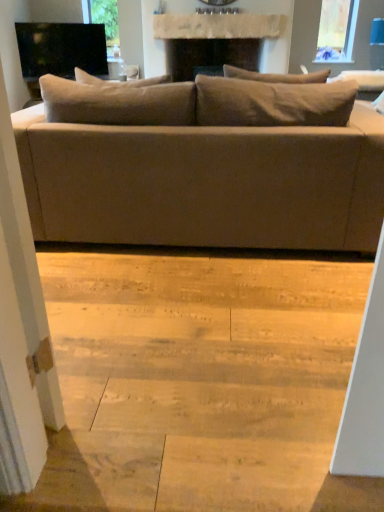
The image size is (384, 512). Identify the location of empty space that is to the right of transparent glass screen door at left. (104, 419).